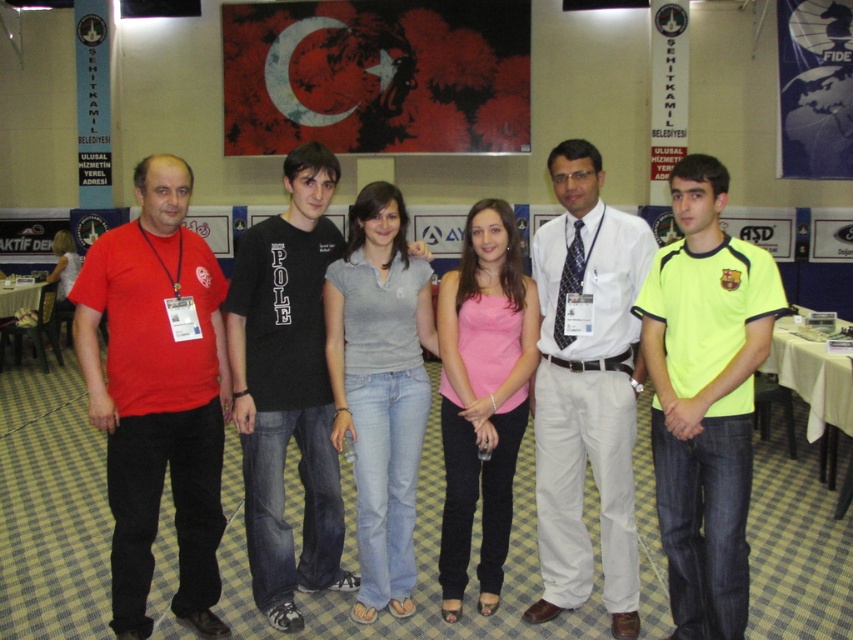
Question: Observing the image, what is the correct spatial positioning of matte red t-shirt at left in reference to white cloth-covered table at lower right?

Choices:
 (A) right
 (B) left

Answer: (B)

Question: Which is farther from the matte red t-shirt at left?

Choices:
 (A) neon yellow jersey at center
 (B) black cotton t-shirt at center
 (C) wooden table at left

Answer: (C)

Question: Which point is farther from the camera taking this photo?

Choices:
 (A) (113, 497)
 (B) (793, 381)
 (C) (660, 436)

Answer: (B)

Question: Does matte red t-shirt at left lie in front of black cotton t-shirt at center?

Choices:
 (A) yes
 (B) no

Answer: (A)

Question: Which point is closer to the camera taking this photo?

Choices:
 (A) (700, 536)
 (B) (291, 291)
 (C) (177, 236)

Answer: (A)

Question: Does white cotton shirt at center appear on the left side of wooden table at left?

Choices:
 (A) no
 (B) yes

Answer: (A)